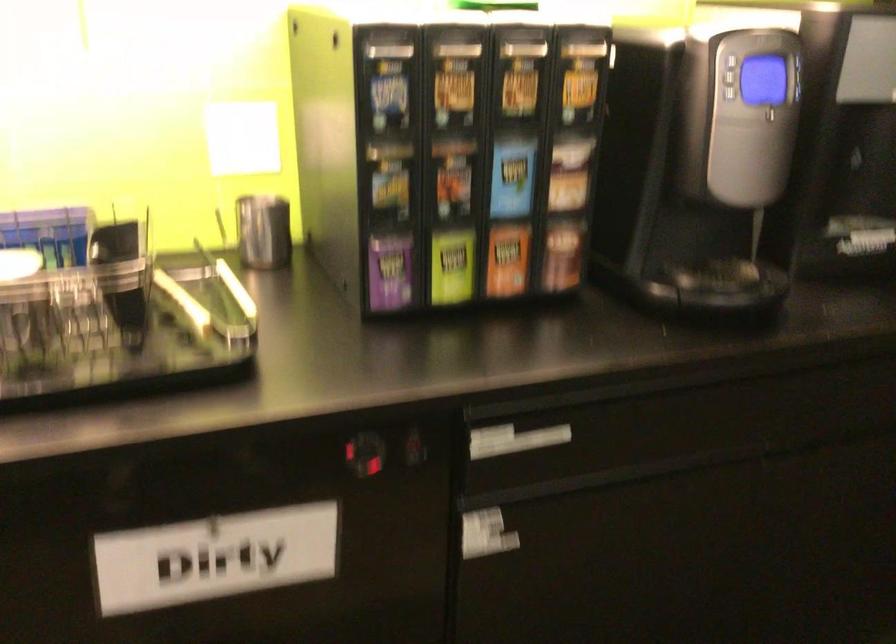
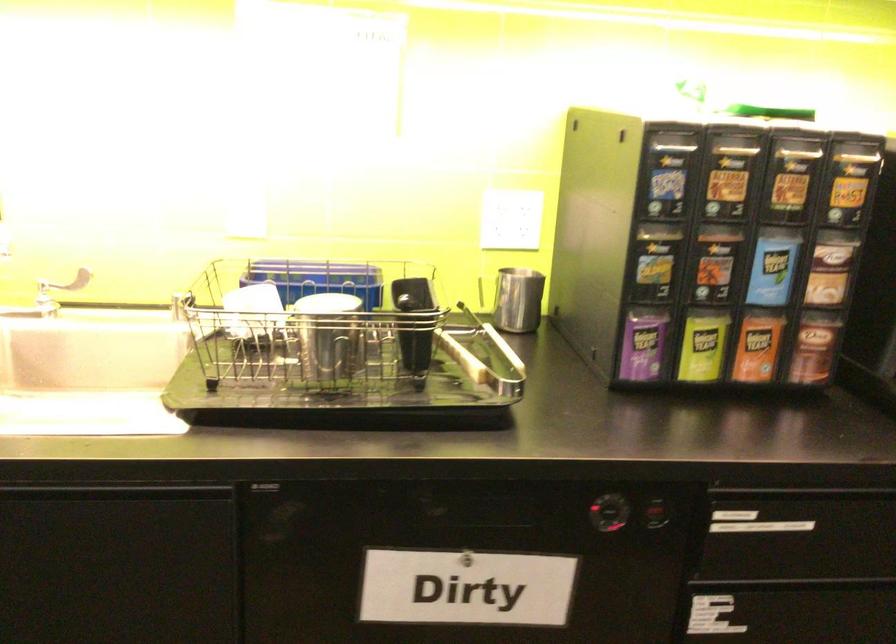
From the picture: In a continuous first-person perspective shot, in which direction is the camera moving?

The cameraman moved toward left, backward.